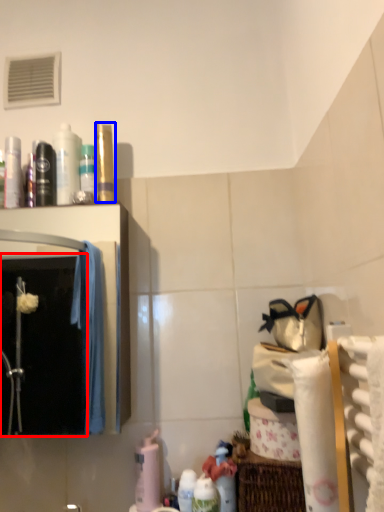
Question: Which object appears farthest to the camera in this image, mirror (highlighted by a red box) or toiletry (highlighted by a blue box)?

Choices:
 (A) mirror
 (B) toiletry

Answer: (B)